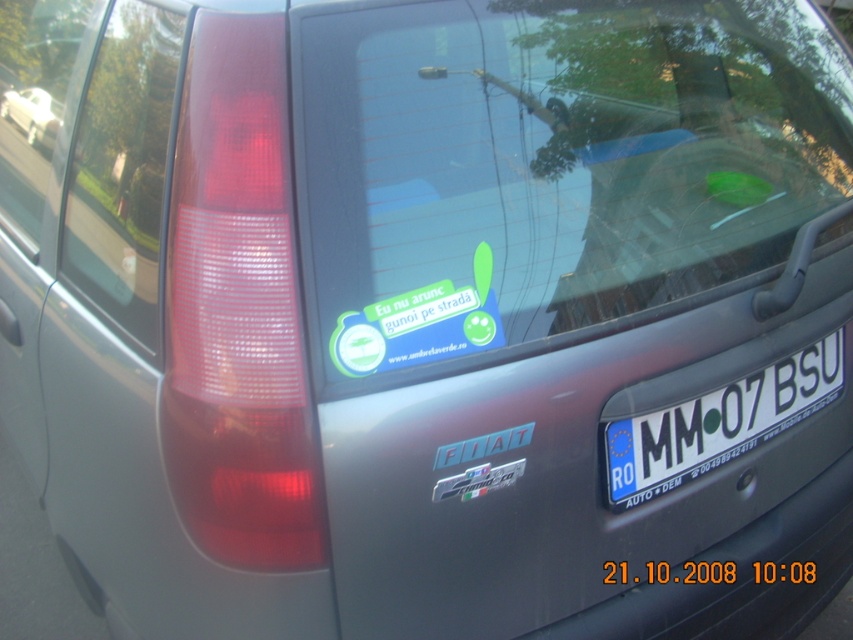
You are a delivery driver who needs to read the license plate of the white glossy sedan at upper left. However, the white plastic license plate at center is blocking your view. Can you still see the license plate number clearly?

The white plastic license plate at center is positioned under the white glossy sedan at upper left, so it might be blocking the view of the license plate number depending on the angle. However, since the license plate is at center and the sedan is at upper left, there might still be a clear line of sight. Without more information on the exact positioning, it is uncertain if the license plate number is fully visible.

You are a driver looking at the rear of a gray Fiat car. You notice the white plastic license plate at center and the white glossy sedan at upper left. Which object is taller?

The white plastic license plate at center is much taller than the white glossy sedan at upper left.

You are a pedestrian standing behind the gray Fiat car. You want to look through the transparent glass windshield at upper center to see the driver. However, the white plastic license plate at center is blocking your view. Is the license plate to the right or left of the windshield?

The transparent glass windshield at upper center is to the left of white plastic license plate at center, so the license plate is to the right of the windshield, blocking your view.